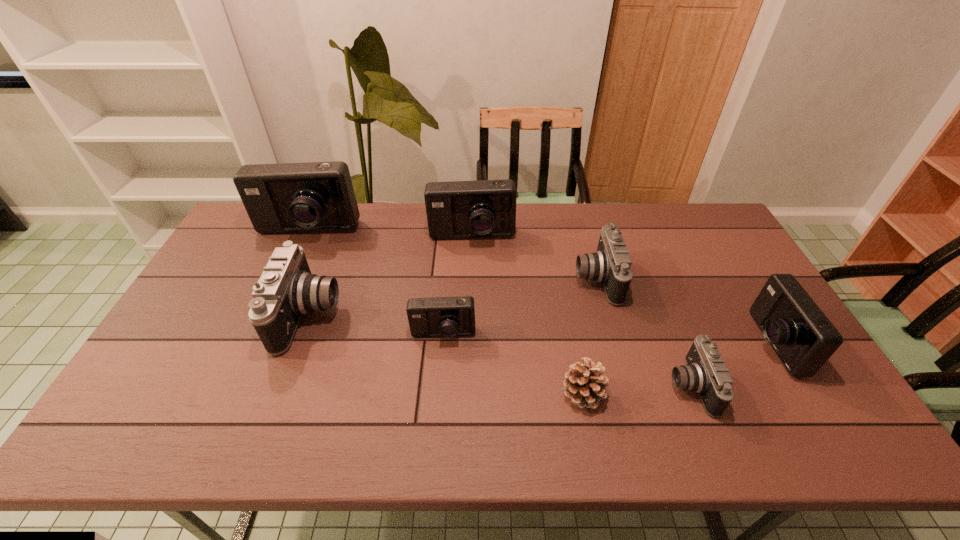
This screenshot has height=540, width=960. In order to click on object situated at the far left corner in this screenshot , I will do `click(316, 196)`.

You are a GUI agent. You are given a task and a screenshot of the screen. Output one action in this format:
    pyautogui.click(x=<x>, y=<y>)
    Task: Click on the free region at the far edge
    The width and height of the screenshot is (960, 540).
    Given the screenshot: What is the action you would take?
    pyautogui.click(x=448, y=244)

The height and width of the screenshot is (540, 960). I want to click on vacant space at the near edge, so click(x=187, y=446).

Image resolution: width=960 pixels, height=540 pixels. Identify the location of vacant space at the left edge of the desktop. (232, 258).

In the image, there is a desktop. Where is `vacant space at the right edge`? This screenshot has height=540, width=960. vacant space at the right edge is located at coordinates (728, 255).

At what (x,y) coordinates should I click in order to perform the action: click on blank space at the far right corner of the desktop. Please return your answer as a coordinate pair (x, y). Looking at the image, I should click on tap(711, 234).

Find the location of a particular element. Image resolution: width=960 pixels, height=540 pixels. vacant point at the near right corner is located at coordinates (858, 441).

I want to click on free space between the third smallest blue camera and the second black camera from right to left, so click(x=534, y=258).

This screenshot has width=960, height=540. I want to click on vacant point located between the second smallest black camera and the second smallest blue camera, so click(x=684, y=310).

Locate an element on the screen. empty location between the smallest blue camera and the leftmost black camera is located at coordinates (376, 325).